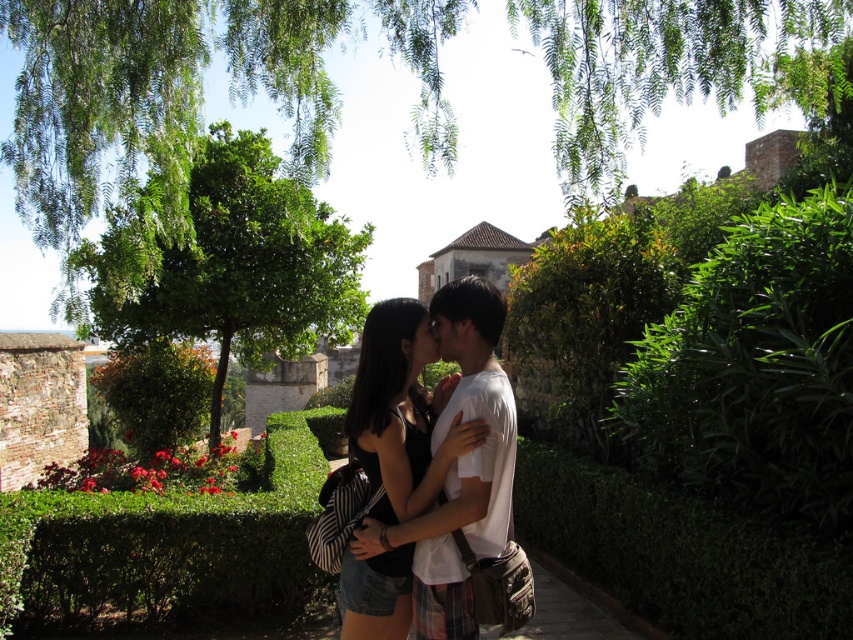
You are a photographer trying to capture the couple in the matte black dress at center and the green leafy tree at upper center in your shot. Which object should you position to the left side of your frame to ensure both are included?

You should position the green leafy tree at upper center to the left side of your frame because it is already to the left of the matte black dress at center, allowing both to be captured in the shot.